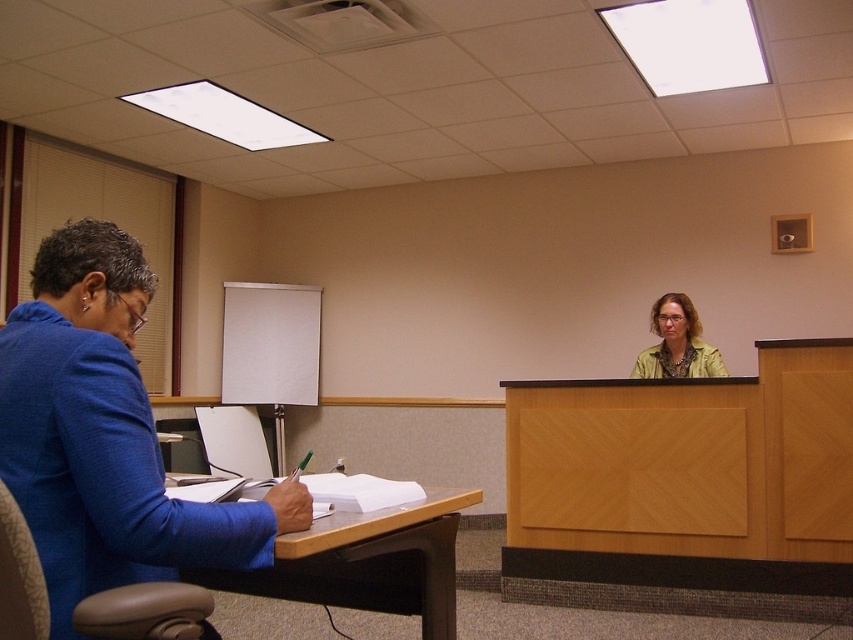
What do you see at coordinates (106, 435) in the screenshot? I see `blue fabric jacket at left` at bounding box center [106, 435].

The height and width of the screenshot is (640, 853). Describe the element at coordinates (106, 435) in the screenshot. I see `blue fabric jacket at left` at that location.

Locate an element on the screen. The width and height of the screenshot is (853, 640). blue fabric jacket at left is located at coordinates (106, 435).

Is point (108, 573) in front of point (103, 598)?

No, (108, 573) is further to viewer.

Can you confirm if blue fabric jacket at left is taller than beige fabric swivel chair at lower left?

Indeed, blue fabric jacket at left has a greater height compared to beige fabric swivel chair at lower left.

Locate an element on the screen. The image size is (853, 640). blue fabric jacket at left is located at coordinates (106, 435).

Measure the distance between point (x=91, y=616) and camera.

The distance of point (x=91, y=616) from camera is 1.12 meters.

Is beige fabric swivel chair at lower left shorter than yellow-green textured blouse at upper right?

Yes.

You are a GUI agent. You are given a task and a screenshot of the screen. Output one action in this format:
    pyautogui.click(x=<x>, y=<y>)
    Task: Click on the beige fabric swivel chair at lower left
    
    Given the screenshot: What is the action you would take?
    pyautogui.click(x=146, y=612)